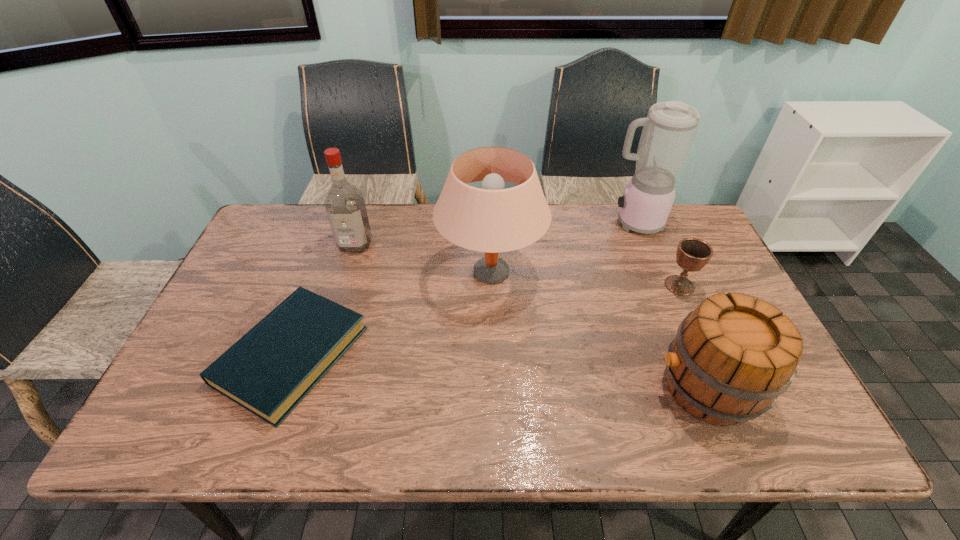
The width and height of the screenshot is (960, 540). Identify the location of food processor. (669, 130).

This screenshot has width=960, height=540. Identify the location of lampshade. (493, 219).

Identify the location of liquor. (345, 207).

This screenshot has height=540, width=960. I want to click on cider, so click(732, 356).

You are a GUI agent. You are given a task and a screenshot of the screen. Output one action in this format:
    pyautogui.click(x=<x>, y=<y>)
    Task: Click on the fifth tallest object
    This screenshot has width=960, height=540.
    Given the screenshot: What is the action you would take?
    pyautogui.click(x=692, y=254)

Image resolution: width=960 pixels, height=540 pixels. I want to click on the shortest object, so click(268, 371).

You are a GUI agent. You are given a task and a screenshot of the screen. Output one action in this format:
    pyautogui.click(x=<x>, y=<y>)
    Task: Click on the free space located 0.190m on the base of the food processor near the control knob
    Image resolution: width=960 pixels, height=540 pixels.
    Given the screenshot: What is the action you would take?
    pyautogui.click(x=548, y=222)

You are a GUI agent. You are given a task and a screenshot of the screen. Output one action in this format:
    pyautogui.click(x=<x>, y=<y>)
    Task: Click on the blank space located 0.200m on the base of the food processor near the control knob
    This screenshot has width=960, height=540.
    Given the screenshot: What is the action you would take?
    pyautogui.click(x=545, y=222)

Locate an element on the screen. This screenshot has height=540, width=960. free space located on the base of the food processor near the control knob is located at coordinates (560, 222).

At what (x,y) coordinates should I click in order to perform the action: click on vacant space situated 0.220m on the front-facing side of the lampshade. Please return your answer as a coordinate pair (x, y). Image resolution: width=960 pixels, height=540 pixels. Looking at the image, I should click on (364, 272).